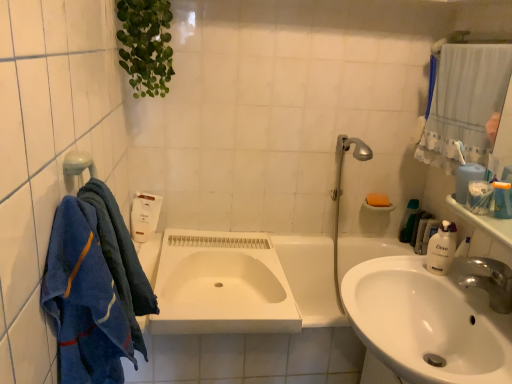
The height and width of the screenshot is (384, 512). I want to click on free region on the left part of white glossy soap dispenser at right, so click(397, 271).